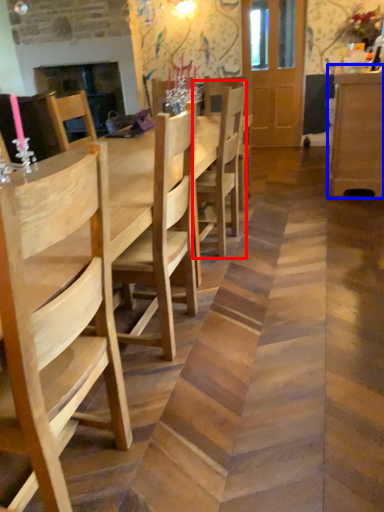
Question: Which object appears closest to the camera in this image, chair (highlighted by a red box) or dresser (highlighted by a blue box)?

Choices:
 (A) chair
 (B) dresser

Answer: (A)